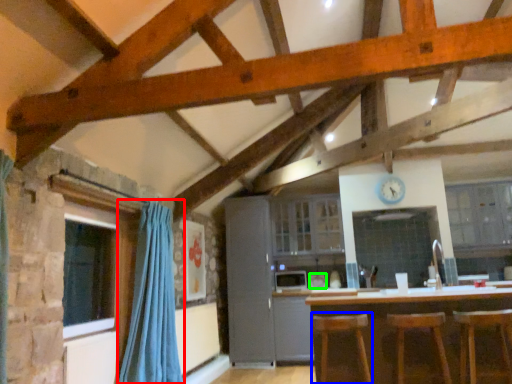
Question: Based on their relative distances, which object is farther from curtain (highlighted by a red box)? Choose from bar stool (highlighted by a blue box) and appliance (highlighted by a green box).

Choices:
 (A) bar stool
 (B) appliance

Answer: (B)